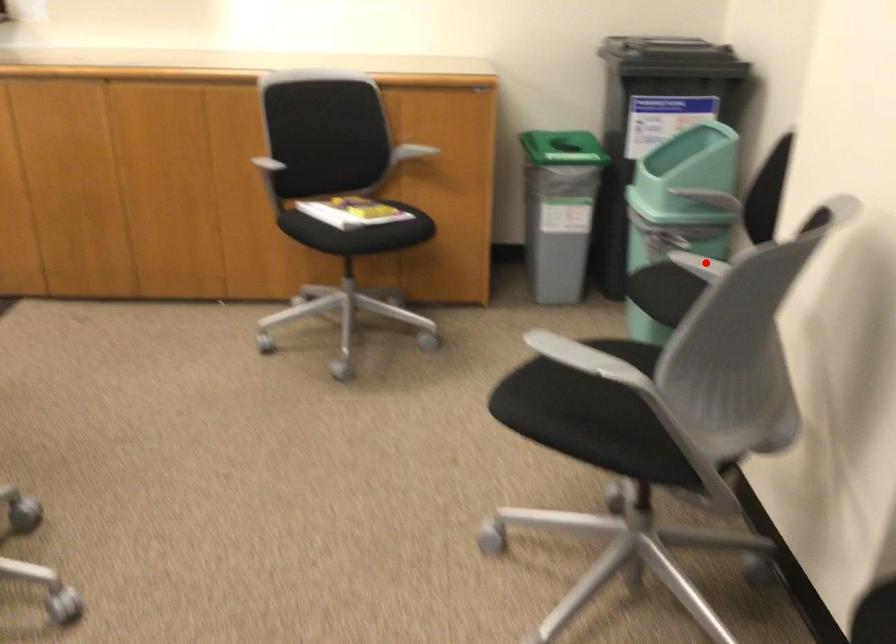
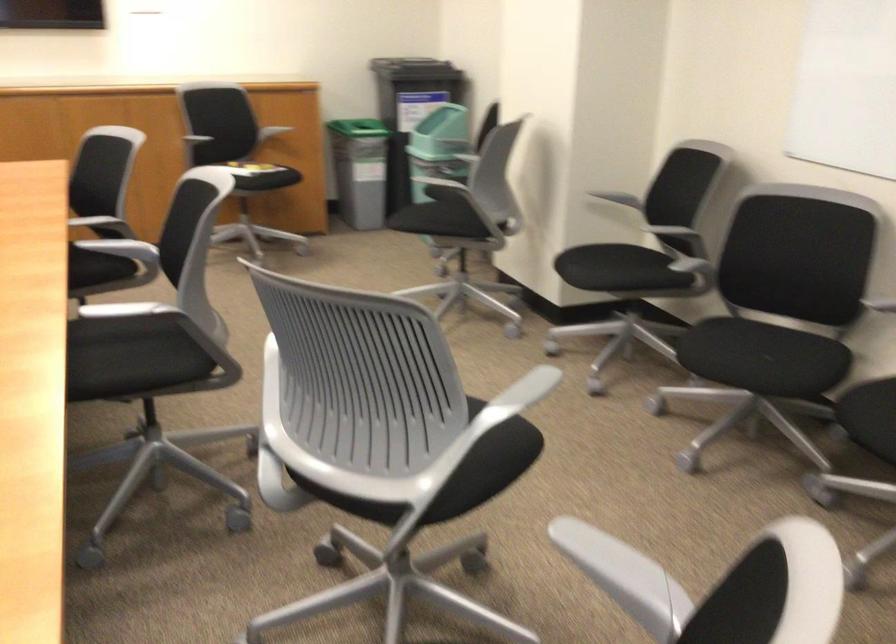
Question: I am providing you with two images of the same scene from different viewpoints. A red point is marked on the first image. At the location where the point appears in image 1, is it still visible in image 2?

Choices:
 (A) Yes
 (B) No

Answer: (B)